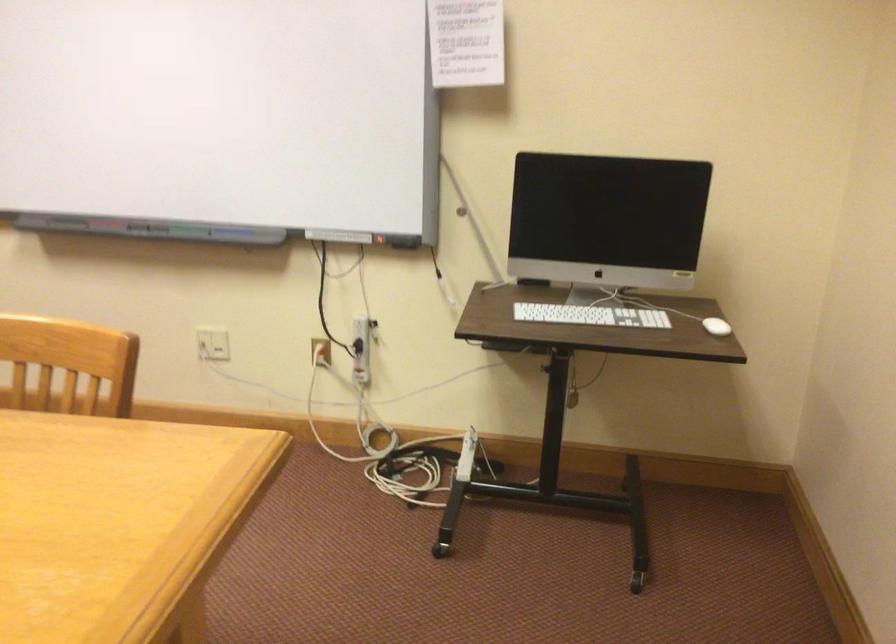
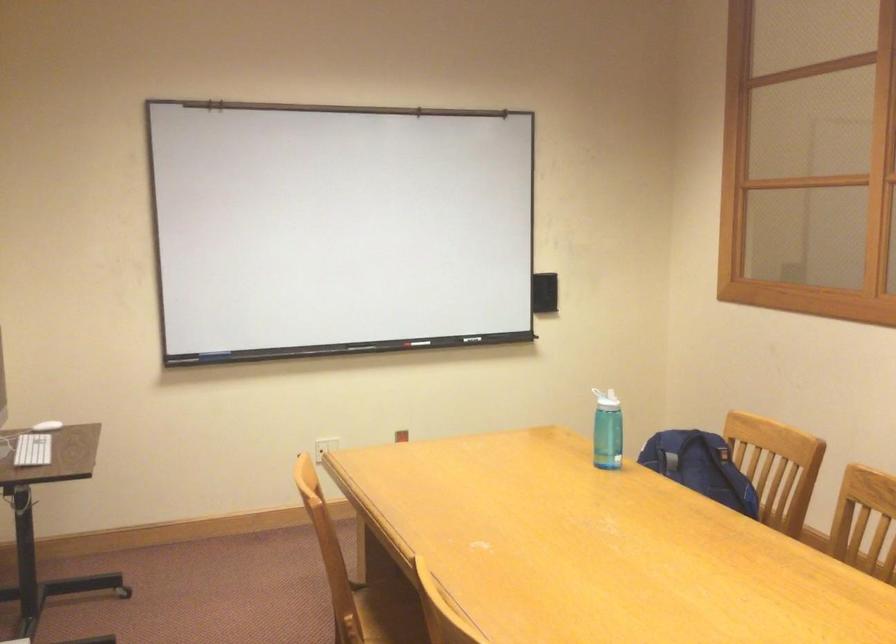
Locate, in the second image, the point that corresponds to (579,314) in the first image.

(32, 450)